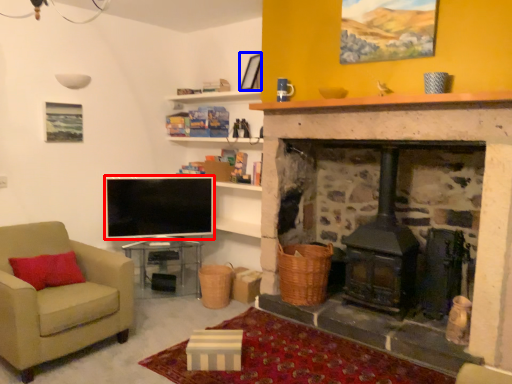
Question: Which object is further to the camera taking this photo, television (highlighted by a red box) or picture frame (highlighted by a blue box)?

Choices:
 (A) television
 (B) picture frame

Answer: (A)